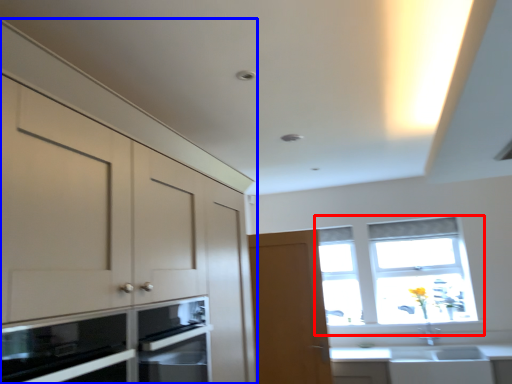
Question: Which object is closer to the camera taking this photo, window (highlighted by a red box) or cabinetry (highlighted by a blue box)?

Choices:
 (A) window
 (B) cabinetry

Answer: (B)